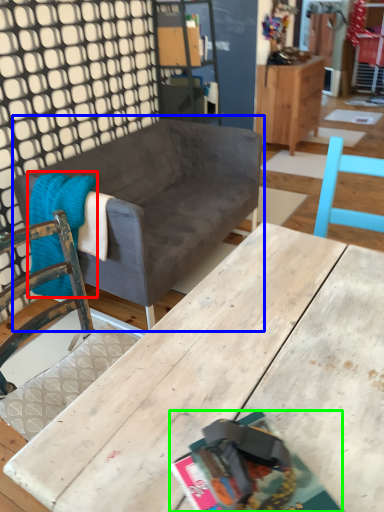
Question: Based on their relative distances, which object is farther from blanket (highlighted by a red box)? Choose from studio couch (highlighted by a blue box) and magazine (highlighted by a green box).

Choices:
 (A) studio couch
 (B) magazine

Answer: (B)